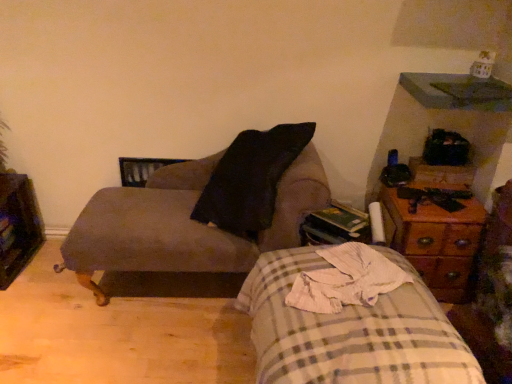
Where is `blank space situated above plaid fabric bed at lower right (from a real-world perspective)`? The width and height of the screenshot is (512, 384). blank space situated above plaid fabric bed at lower right (from a real-world perspective) is located at coordinates (346, 285).